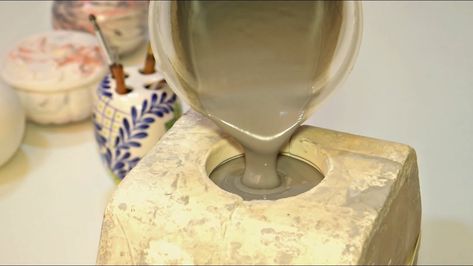
Find the location of `decorative blue and white brush holder`. decorative blue and white brush holder is located at coordinates (152, 123).